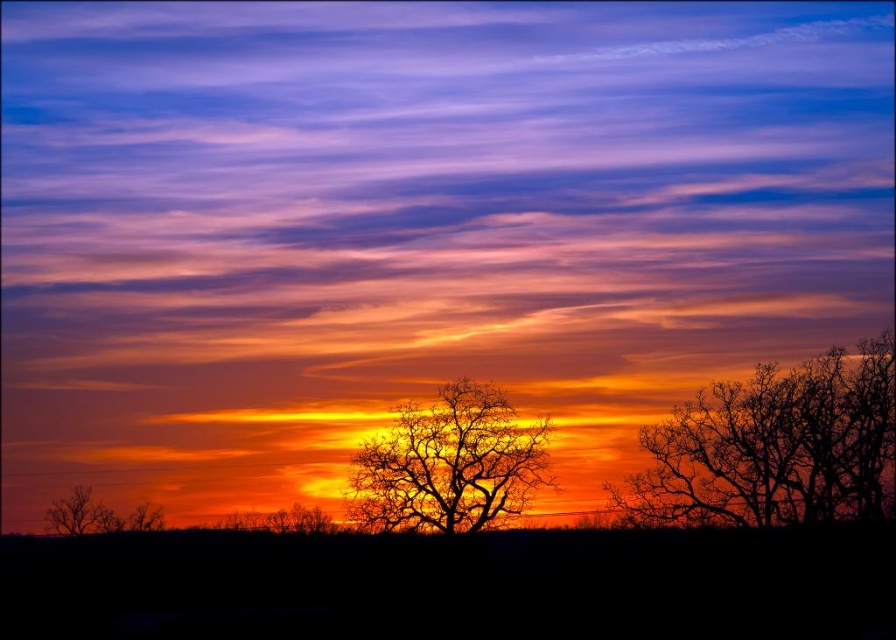
You are an artist sketching the sunset scene. You want to draw the silhouette bare tree at right and the brown matte tree at lower left. Which tree should you draw first to maintain proper spatial depth?

You should draw the brown matte tree at lower left first because the silhouette bare tree at right is closer to the viewer, so it should be placed over the top of the brown matte tree at lower left to maintain depth.

You are an artist sketching the sunset scene. You need to place the silhouette bare tree at center and the brown matte tree at lower left in your drawing. According to the scene, which tree should be positioned to the right side of the other?

The silhouette bare tree at center should be positioned to the right of the brown matte tree at lower left because the description states that the silhouette bare tree at center is to the right of brown matte tree at lower left.

You are an artist trying to sketch the sunset scene. You notice two silhouette bare trees in the foreground. Which tree, the silhouette bare tree at right or the silhouette bare tree at center, is located more to the right side of the image?

The silhouette bare tree at right is positioned on the right side of the silhouette bare tree at center, so it is located more to the right side of the image.